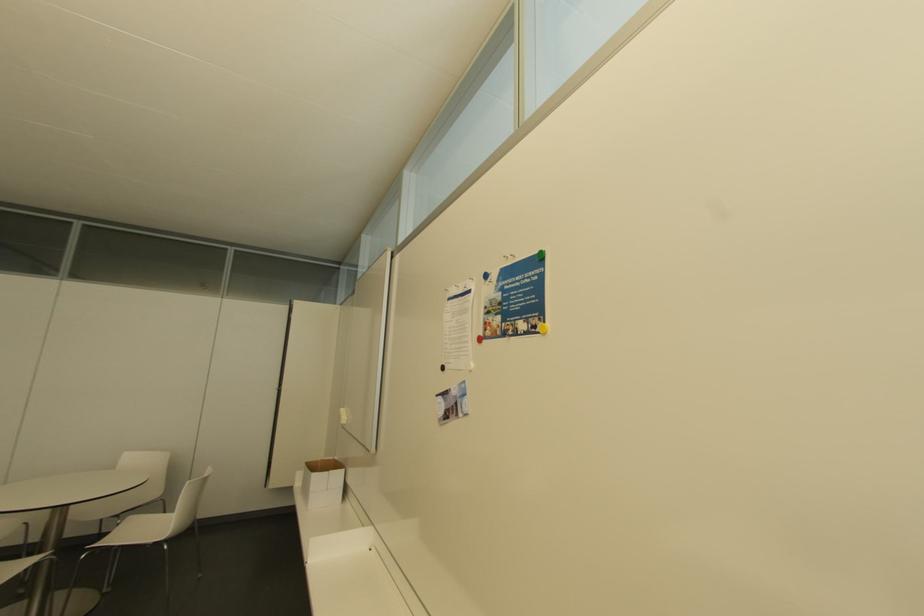
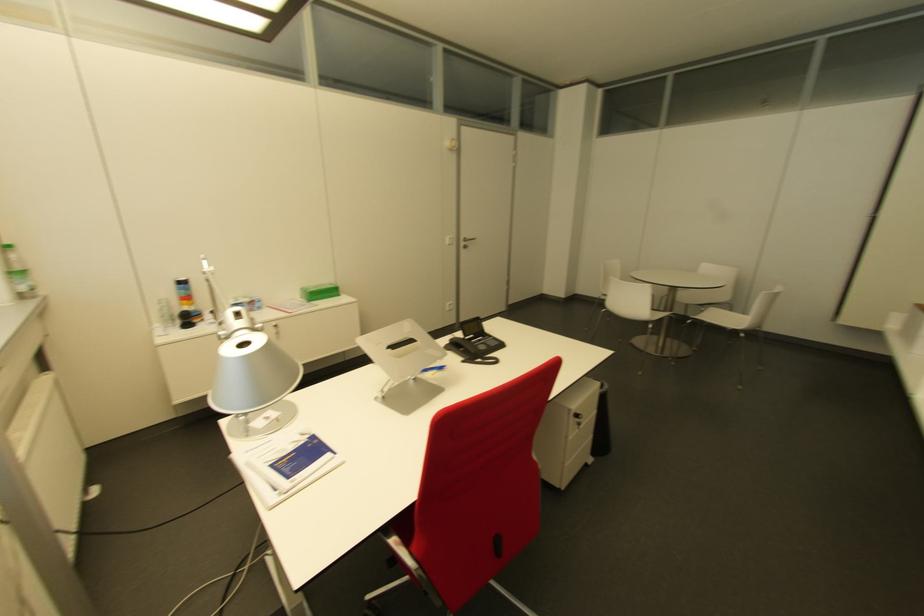
The point at (116,525) is marked in the first image. Where is the corresponding point in the second image?

(700, 310)